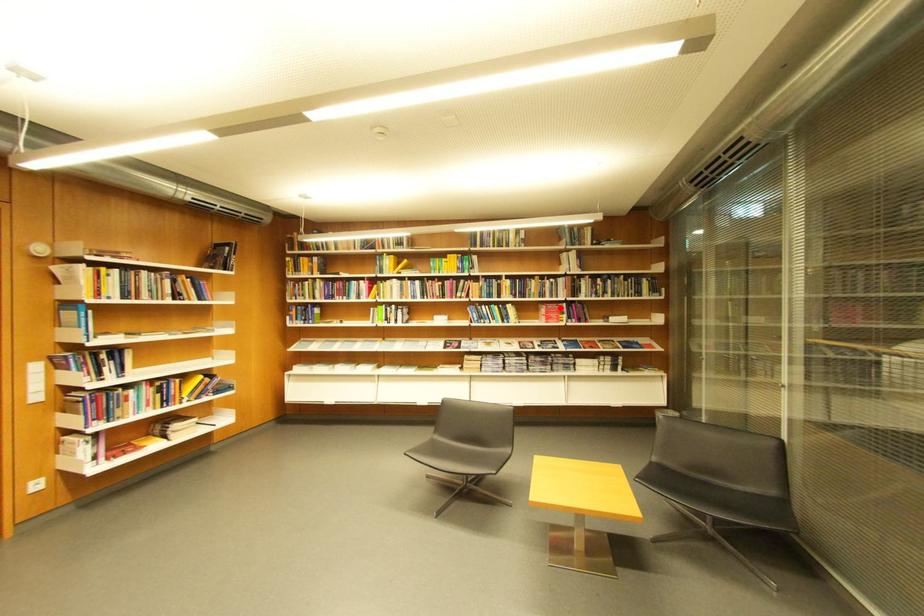
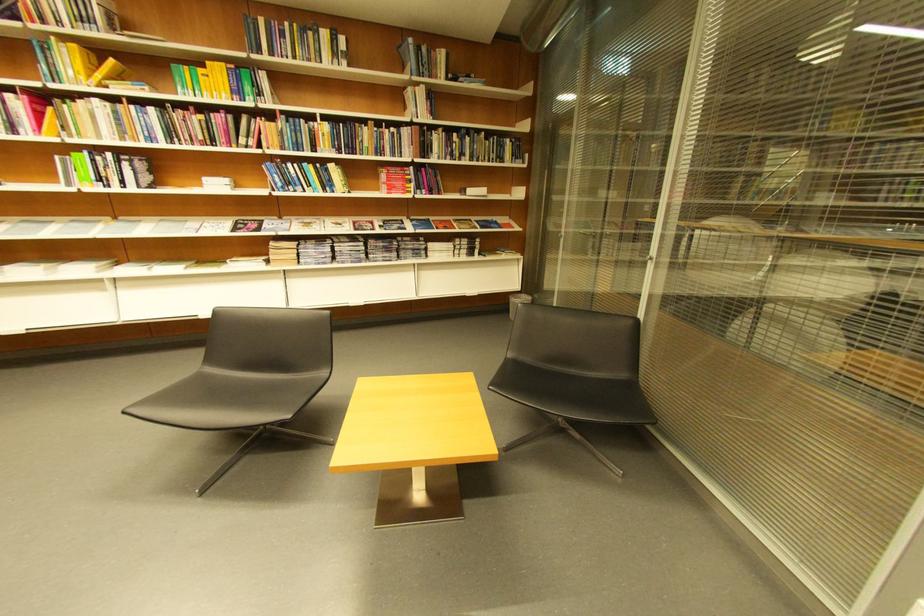
Question: I am providing you with two images of the same scene from different viewpoints. A red point is shown in image1. For the corresponding object point in image2, is it positioned nearer or farther from the camera?

Choices:
 (A) Nearer
 (B) Farther

Answer: (A)